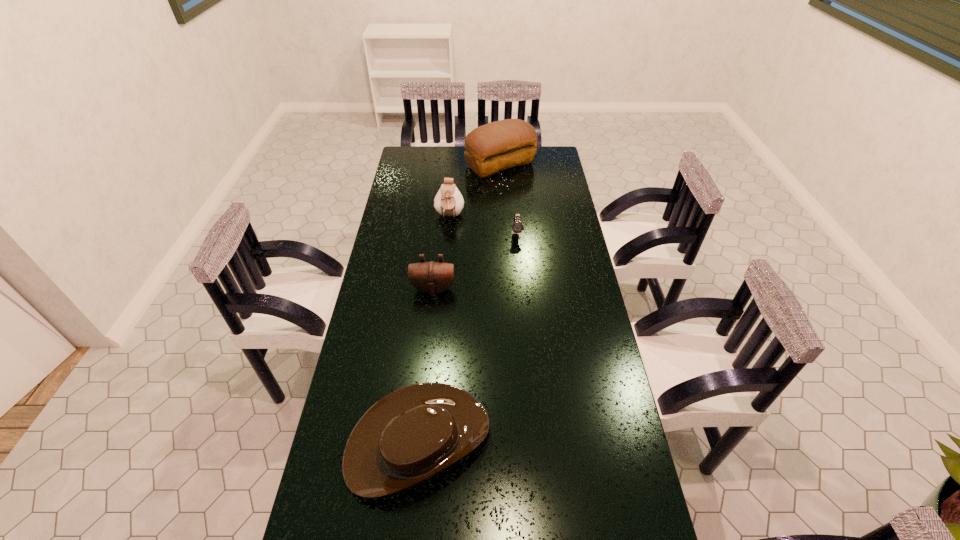
Locate an element on the screen. The height and width of the screenshot is (540, 960). free space between the farthest object and the cowboy hat is located at coordinates (460, 302).

Where is `vacant area that lies between the nearest object and the farthest object`? The width and height of the screenshot is (960, 540). vacant area that lies between the nearest object and the farthest object is located at coordinates (460, 302).

At what (x,y) coordinates should I click in order to perform the action: click on unoccupied position between the taller pouch and the cowboy hat. Please return your answer as a coordinate pair (x, y). Looking at the image, I should click on (434, 328).

Identify the location of object that stands as the closest to the farthest object. (448, 202).

Identify which object is located as the fourth nearest to the fourth farthest object. Please provide its 2D coordinates. Your answer should be formatted as a tuple, i.e. [(x, y)], where the tuple contains the x and y coordinates of a point satisfying the conditions above.

[(496, 146)]